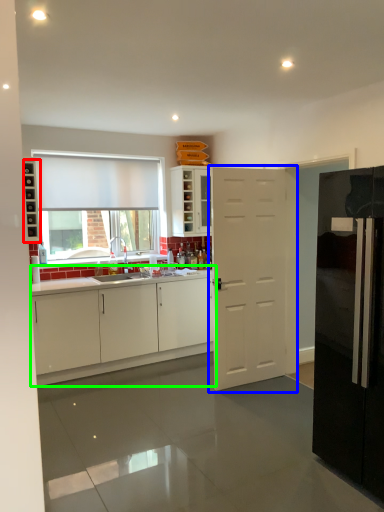
Question: Based on their relative distances, which object is nearer to shelf (highlighted by a red box)? Choose from door (highlighted by a blue box) and cabinetry (highlighted by a green box).

Choices:
 (A) door
 (B) cabinetry

Answer: (A)